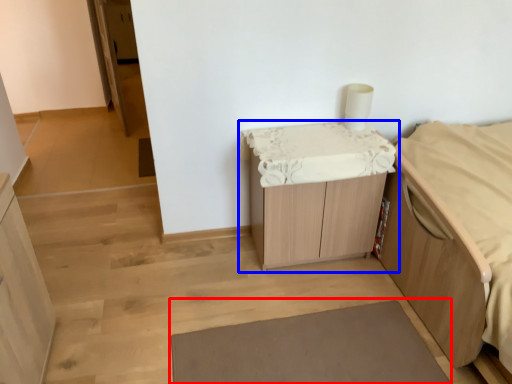
Question: Which point is further to the camera, bath mat (highlighted by a red box) or table (highlighted by a blue box)?

Choices:
 (A) bath mat
 (B) table

Answer: (B)